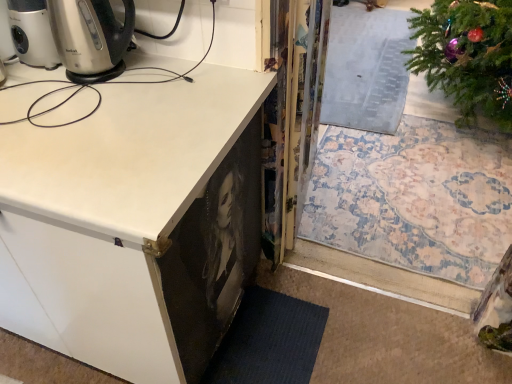
At what (x,y) coordinates should I click in order to perform the action: click on vacant point to the right of transparent plastic screen door at center. Please return your answer as a coordinate pair (x, y). Looking at the image, I should click on (373, 173).